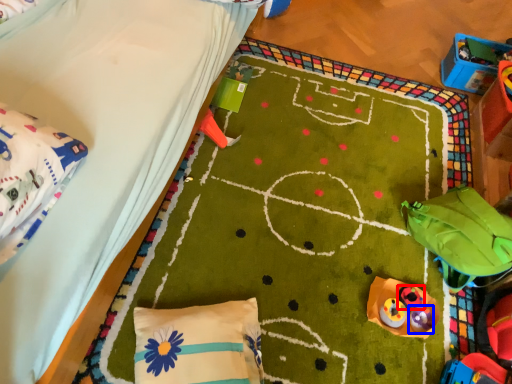
Question: Which object is closer to the camera taking this photo, toy (highlighted by a red box) or toy (highlighted by a blue box)?

Choices:
 (A) toy
 (B) toy

Answer: (B)